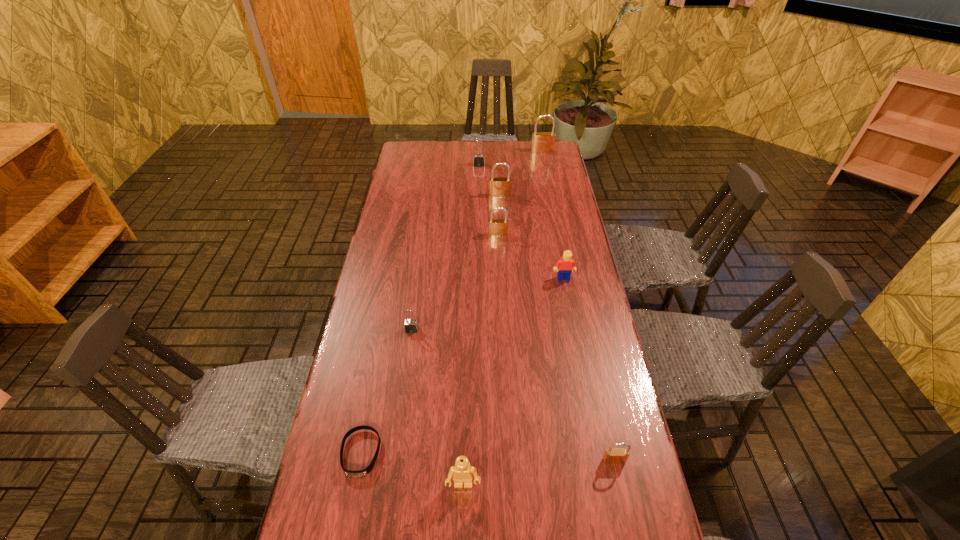
This screenshot has width=960, height=540. I want to click on the nearer Lego, so click(462, 472).

Image resolution: width=960 pixels, height=540 pixels. In order to click on the left gray padlock in this screenshot , I will do `click(411, 325)`.

Where is `the eighth object from right to left`? This screenshot has width=960, height=540. the eighth object from right to left is located at coordinates (411, 325).

Where is `the nearest brass padlock`? The image size is (960, 540). the nearest brass padlock is located at coordinates (612, 456).

At what (x,y) coordinates should I click in order to perform the action: click on the nearest padlock. Please return your answer as a coordinate pair (x, y). The width and height of the screenshot is (960, 540). Looking at the image, I should click on (612, 456).

This screenshot has width=960, height=540. Identify the location of the leftmost object. pos(360,473).

Locate an element on the screen. the shortest object is located at coordinates [x=360, y=473].

Find the location of `vacant space located 0.230m on the front-facing side of the biggest brass padlock`. vacant space located 0.230m on the front-facing side of the biggest brass padlock is located at coordinates (548, 180).

Where is `vacant area located on the front-facing side of the second farthest brass padlock`? This screenshot has height=540, width=960. vacant area located on the front-facing side of the second farthest brass padlock is located at coordinates (504, 258).

At what (x,y) coordinates should I click in order to perform the action: click on free spot located 0.110m on the shackle of the right gray padlock. Please return your answer as a coordinate pair (x, y). The width and height of the screenshot is (960, 540). Looking at the image, I should click on (479, 180).